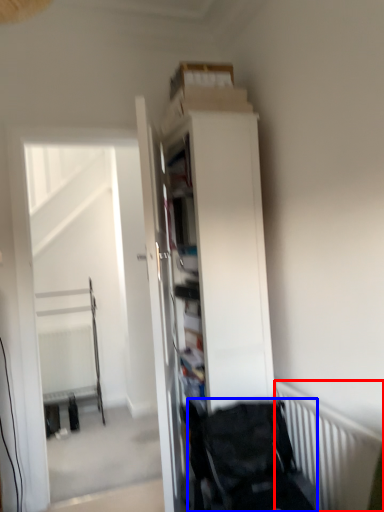
Question: Which object is closer to the camera taking this photo, radiator (highlighted by a red box) or baby carriage (highlighted by a blue box)?

Choices:
 (A) radiator
 (B) baby carriage

Answer: (A)